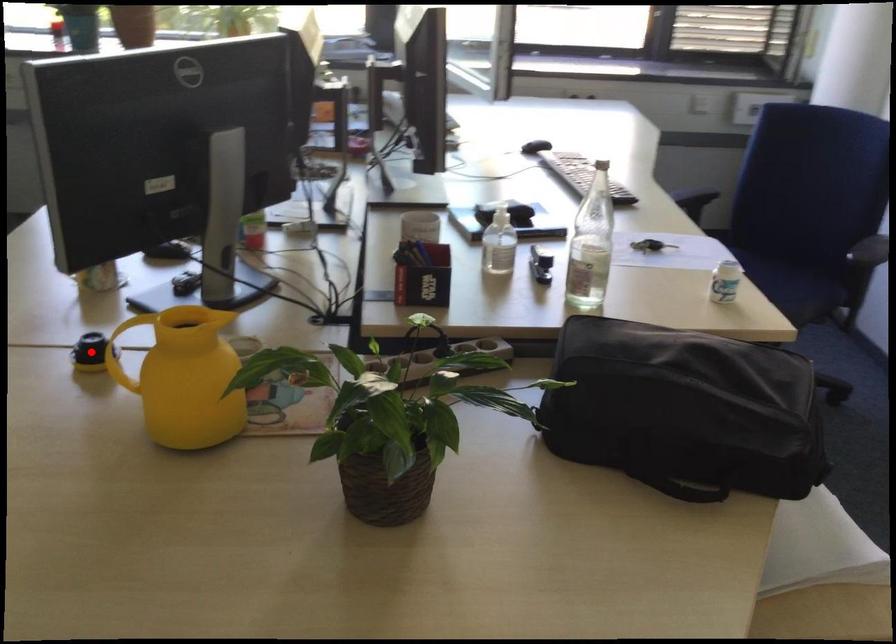
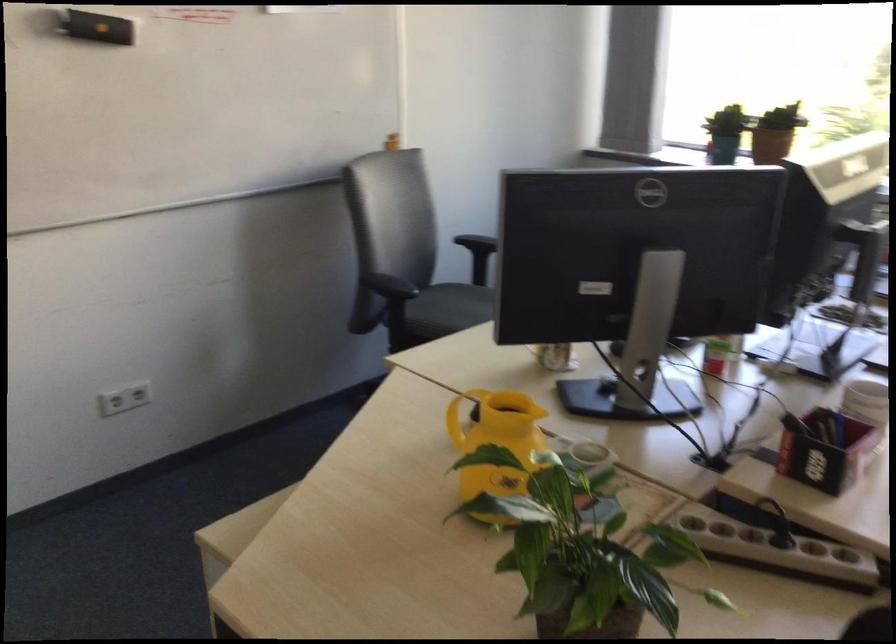
Question: I am providing you with two images of the same scene from different viewpoints. A red point is marked on the first image. At the location where the point appears in image 1, is it still visible in image 2?

Choices:
 (A) Yes
 (B) No

Answer: (B)